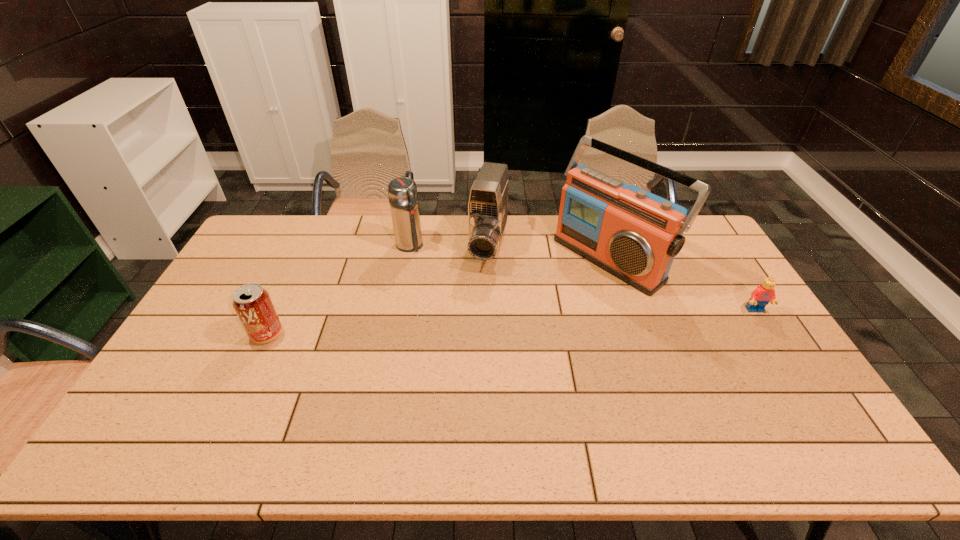
Image resolution: width=960 pixels, height=540 pixels. Identify the location of vacant region located 0.220m with a handle on the side of the thermos bottle. (449, 288).

Where is `vacant space situated 0.220m with a handle on the side of the thermos bottle`? This screenshot has width=960, height=540. vacant space situated 0.220m with a handle on the side of the thermos bottle is located at coordinates tap(449, 288).

The width and height of the screenshot is (960, 540). I want to click on blank area located with a handle on the side of the thermos bottle, so click(x=468, y=309).

Image resolution: width=960 pixels, height=540 pixels. I want to click on free space located at the front of the camcorder, highlighting the lens, so 472,313.

Locate an element on the screen. The height and width of the screenshot is (540, 960). vacant space located at the front of the camcorder, highlighting the lens is located at coordinates (480, 291).

Find the location of a particular element. free space located 0.150m at the front of the camcorder, highlighting the lens is located at coordinates (474, 308).

This screenshot has height=540, width=960. Find the location of `free space located on the front-facing side of the second object from right to left`. free space located on the front-facing side of the second object from right to left is located at coordinates (567, 290).

The width and height of the screenshot is (960, 540). I want to click on vacant area situated on the front-facing side of the second object from right to left, so click(495, 342).

You are a GUI agent. You are given a task and a screenshot of the screen. Output one action in this format:
    pyautogui.click(x=<x>, y=<y>)
    Task: Click on the vacant space located 0.050m on the front-facing side of the second object from right to left
    This screenshot has width=960, height=540.
    Given the screenshot: What is the action you would take?
    pyautogui.click(x=567, y=290)

Image resolution: width=960 pixels, height=540 pixels. What are the coordinates of `thermos bottle positioned at the far edge` in the screenshot? It's located at (402, 192).